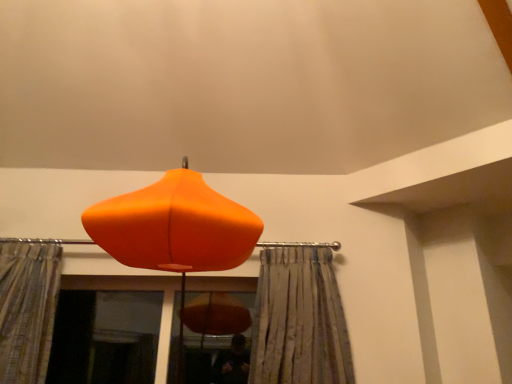
Question: Does silky gray curtain at center, which appears as the 2th curtain when viewed from the left, have a greater width compared to textured beige curtain at left, which appears as the 1th curtain when viewed from the left?

Choices:
 (A) yes
 (B) no

Answer: (B)

Question: From a real-world perspective, is silky gray curtain at center, which appears as the 2th curtain when viewed from the left, physically below textured beige curtain at left, which appears as the 1th curtain when viewed from the left?

Choices:
 (A) no
 (B) yes

Answer: (B)

Question: Is silky gray curtain at center, which appears as the 2th curtain when viewed from the left, closer to camera compared to textured beige curtain at left, which appears as the 1th curtain when viewed from the left?

Choices:
 (A) yes
 (B) no

Answer: (B)

Question: Is silky gray curtain at center, which appears as the 2th curtain when viewed from the left, to the right of textured beige curtain at left, which appears as the 1th curtain when viewed from the left, from the viewer's perspective?

Choices:
 (A) yes
 (B) no

Answer: (A)

Question: Does silky gray curtain at center, the first curtain when ordered from right to left, have a larger size compared to textured beige curtain at left, which appears as the 1th curtain when viewed from the left?

Choices:
 (A) yes
 (B) no

Answer: (A)

Question: Would you say silky gray curtain at center, the first curtain when ordered from right to left, is a long distance from textured beige curtain at left, which appears as the 1th curtain when viewed from the left?

Choices:
 (A) yes
 (B) no

Answer: (A)

Question: Is orange matte lampshade at center closer to the viewer compared to transparent glass screen door at lower left?

Choices:
 (A) yes
 (B) no

Answer: (A)

Question: From a real-world perspective, does orange matte lampshade at center sit lower than transparent glass screen door at lower left?

Choices:
 (A) yes
 (B) no

Answer: (B)

Question: Is orange matte lampshade at center positioned with its back to transparent glass screen door at lower left?

Choices:
 (A) no
 (B) yes

Answer: (A)

Question: Is orange matte lampshade at center wider than transparent glass screen door at lower left?

Choices:
 (A) yes
 (B) no

Answer: (A)

Question: Is orange matte lampshade at center bigger than transparent glass screen door at lower left?

Choices:
 (A) yes
 (B) no

Answer: (A)

Question: Is orange matte lampshade at center oriented towards transparent glass screen door at lower left?

Choices:
 (A) no
 (B) yes

Answer: (A)

Question: Could you tell me if transparent glass screen door at lower left is facing orange matte lampshade at center?

Choices:
 (A) no
 (B) yes

Answer: (B)